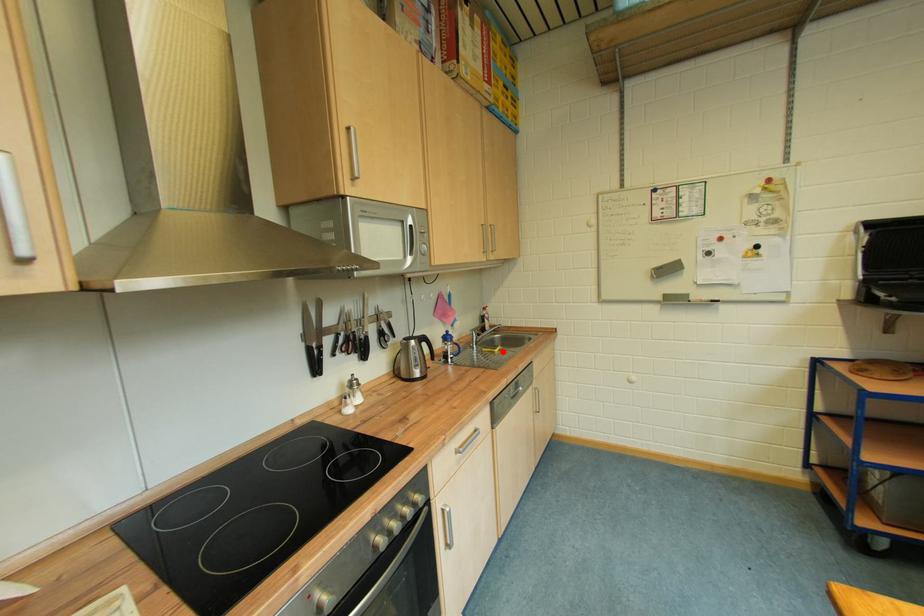
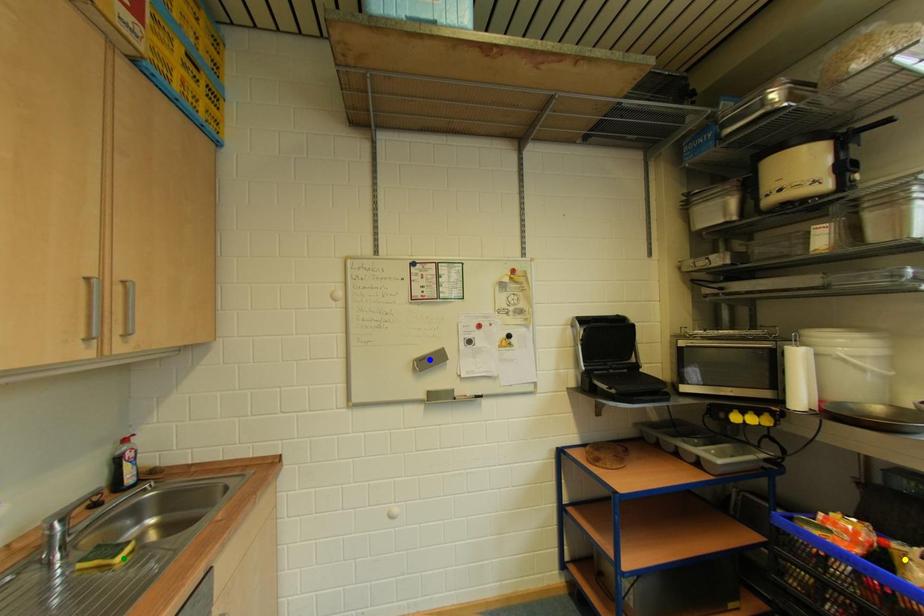
Question: I am providing you with two images of the same scene from different viewpoints. A red point is marked on the first image. You are given multiple points on the second image. In image 2, which mark is for the same physical point as the one in image 1?

Choices:
 (A) yellow point
 (B) green point
 (C) blue point

Answer: (B)